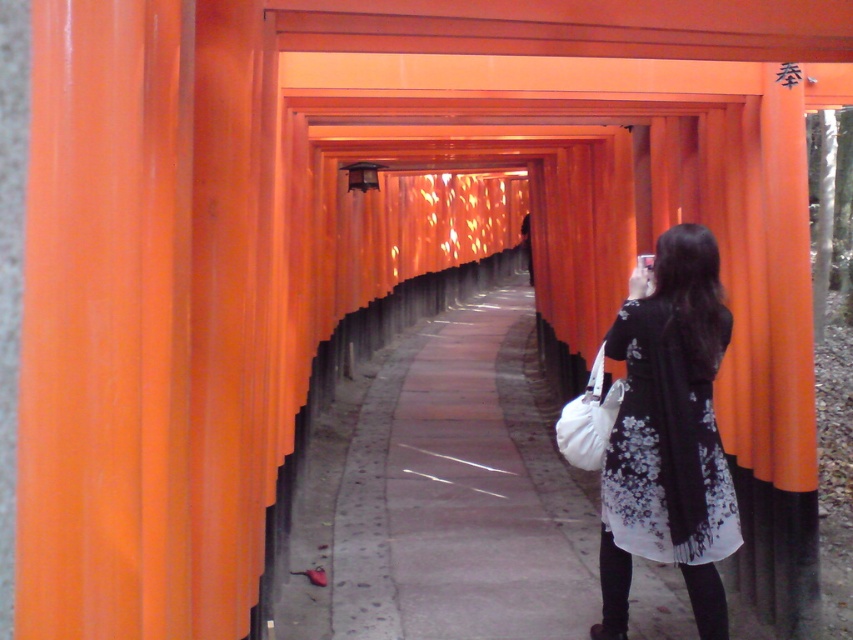
Is black floral dress at center wider than white fabric bag at center-right?

Yes.

Which is more to the left, black floral dress at center or white fabric bag at center-right?

Positioned to the left is white fabric bag at center-right.

At what (x,y) coordinates should I click in order to perform the action: click on black floral dress at center. Please return your answer as a coordinate pair (x, y). This screenshot has height=640, width=853. Looking at the image, I should click on (668, 435).

Where is `black floral dress at center`? black floral dress at center is located at coordinates (668, 435).